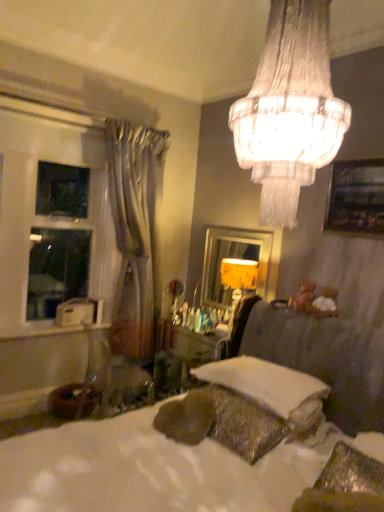
Describe the element at coordinates (148, 470) in the screenshot. I see `white textured bed at center` at that location.

Measure the distance between point (78, 153) and camera.

Point (78, 153) is 11.07 feet away from camera.

The height and width of the screenshot is (512, 384). What do you see at coordinates (233, 258) in the screenshot?
I see `yellow fabric mirror at center` at bounding box center [233, 258].

The width and height of the screenshot is (384, 512). In order to click on wooden framed picture at upper right in this screenshot , I will do `click(356, 198)`.

Which object is more forward, yellow fabric mirror at center or wooden framed picture at upper right?

wooden framed picture at upper right is in front.

Considering the relative sizes of yellow fabric mirror at center and wooden framed picture at upper right in the image provided, is yellow fabric mirror at center bigger than wooden framed picture at upper right?

Correct, yellow fabric mirror at center is larger in size than wooden framed picture at upper right.

The height and width of the screenshot is (512, 384). I want to click on picture frame above the yellow fabric mirror at center (from the image's perspective), so click(356, 198).

Considering the relative positions of yellow fabric mirror at center and wooden framed picture at upper right in the image provided, is yellow fabric mirror at center to the left or to the right of wooden framed picture at upper right?

In the image, yellow fabric mirror at center appears on the left side of wooden framed picture at upper right.

Does yellow fabric mirror at center contain crystalline glass chandelier at upper center?

Definitely not — crystalline glass chandelier at upper center is not inside yellow fabric mirror at center.

How many degrees apart are the facing directions of yellow fabric mirror at center and crystalline glass chandelier at upper center?

yellow fabric mirror at center and crystalline glass chandelier at upper center are facing 1.7 degrees away from each other.

At what (x,y) coordinates should I click in order to perform the action: click on lamp located above the yellow fabric mirror at center (from a real-world perspective). Please return your answer as a coordinate pair (x, y). The height and width of the screenshot is (512, 384). Looking at the image, I should click on (289, 109).

From the image's perspective, is yellow fabric mirror at center above or below crystalline glass chandelier at upper center?

Based on their image positions, yellow fabric mirror at center is located beneath crystalline glass chandelier at upper center.

Looking at the image, does white glossy window at left seem bigger or smaller compared to wooden framed picture at upper right?

white glossy window at left is bigger than wooden framed picture at upper right.

Considering the sizes of white glossy window at left and wooden framed picture at upper right in the image, is white glossy window at left wider or thinner than wooden framed picture at upper right?

In the image, white glossy window at left appears to be wider than wooden framed picture at upper right.

Is white glossy window at left next to wooden framed picture at upper right?

There is a gap between white glossy window at left and wooden framed picture at upper right.

Does white glossy window at left have a lesser height compared to wooden framed picture at upper right?

In fact, white glossy window at left may be taller than wooden framed picture at upper right.

Visually, is wooden framed picture at upper right positioned to the left or to the right of crystalline glass chandelier at upper center?

In the image, wooden framed picture at upper right appears on the right side of crystalline glass chandelier at upper center.

Could you measure the distance between wooden framed picture at upper right and crystalline glass chandelier at upper center?

A distance of 4.80 feet exists between wooden framed picture at upper right and crystalline glass chandelier at upper center.

From the image's perspective, which is below, wooden framed picture at upper right or crystalline glass chandelier at upper center?

wooden framed picture at upper right.

Find the location of a particular element. The width and height of the screenshot is (384, 512). picture frame on the right of crystalline glass chandelier at upper center is located at coordinates (356, 198).

Between white textured bed at center and white glossy window at left, which one has smaller width?

white glossy window at left is thinner.

Relative to white glossy window at left, is white textured bed at center in front or behind?

white textured bed at center is positioned closer to the viewer than white glossy window at left.

What's the angular difference between white textured bed at center and white glossy window at left's facing directions?

88.8 degrees.

Is white glossy window at left located within white textured bed at center?

No, white textured bed at center does not contain white glossy window at left.

Is white glossy window at left facing towards white textured bed at center?

Yes, white glossy window at left is facing white textured bed at center.

Consider the image. Visually, is white glossy window at left positioned to the left or to the right of white textured bed at center?

Clearly, white glossy window at left is on the left of white textured bed at center in the image.

From the image's perspective, which one is positioned lower, white glossy window at left or white textured bed at center?

From the image's view, white textured bed at center is below.

From a real-world perspective, is white glossy window at left located beneath white textured bed at center?

No.

Considering the sizes of objects crystalline glass chandelier at upper center and yellow fabric mirror at center in the image provided, who is taller, crystalline glass chandelier at upper center or yellow fabric mirror at center?

crystalline glass chandelier at upper center is taller.

Are crystalline glass chandelier at upper center and yellow fabric mirror at center far apart?

Indeed, crystalline glass chandelier at upper center is not near yellow fabric mirror at center.

Can you confirm if crystalline glass chandelier at upper center is wider than yellow fabric mirror at center?

Indeed, crystalline glass chandelier at upper center has a greater width compared to yellow fabric mirror at center.

Is crystalline glass chandelier at upper center to the left of yellow fabric mirror at center from the viewer's perspective?

Yes, crystalline glass chandelier at upper center is to the left of yellow fabric mirror at center.

Identify the location of picture frame that appears above the yellow fabric mirror at center (from the image's perspective). This screenshot has width=384, height=512. (356, 198).

The height and width of the screenshot is (512, 384). Identify the location of mirror behind the crystalline glass chandelier at upper center. (233, 258).

When comparing their distances from wooden framed picture at upper right, does crystalline glass chandelier at upper center or white glossy window at left seem closer?

Among the two, crystalline glass chandelier at upper center is located nearer to wooden framed picture at upper right.

When comparing their distances from white glossy window at left, does silvery drapery at left or crystalline glass chandelier at upper center seem closer?

Based on the image, silvery drapery at left appears to be nearer to white glossy window at left.

Considering their positions, is white textured bed at center positioned further to wooden framed picture at upper right than white soft pillow at lower center?

white soft pillow at lower center is positioned further to the anchor wooden framed picture at upper right.

Estimate the real-world distances between objects in this image. Which object is closer to white textured bed at center, white glossy window at left or wooden framed picture at upper right?

wooden framed picture at upper right.

From the image, which object appears to be farther from wooden framed picture at upper right, white textured bed at center or yellow fabric mirror at center?

Among the two, white textured bed at center is located further to wooden framed picture at upper right.

When comparing their distances from white soft pillow at lower center, does white glossy window at left or yellow fabric mirror at center seem further?

The object further to white soft pillow at lower center is white glossy window at left.

Based on their spatial positions, is white textured bed at center or silvery drapery at left further from yellow fabric mirror at center?

white textured bed at center lies further to yellow fabric mirror at center than the other object.

When comparing their distances from white textured bed at center, does silvery drapery at left or white soft pillow at lower center seem closer?

white soft pillow at lower center is closer to white textured bed at center.

Identify the location of pillow between crystalline glass chandelier at upper center and white glossy window at left along the z-axis. This screenshot has width=384, height=512. (264, 382).

This screenshot has height=512, width=384. I want to click on pillow between crystalline glass chandelier at upper center and wooden framed picture at upper right along the z-axis, so click(264, 382).

Where is `pillow situated between silvery drapery at left and wooden framed picture at upper right from left to right`? Image resolution: width=384 pixels, height=512 pixels. pillow situated between silvery drapery at left and wooden framed picture at upper right from left to right is located at coordinates (264, 382).

Find the location of `pillow between white textured bed at center and yellow fabric mirror at center from front to back`. pillow between white textured bed at center and yellow fabric mirror at center from front to back is located at coordinates click(264, 382).